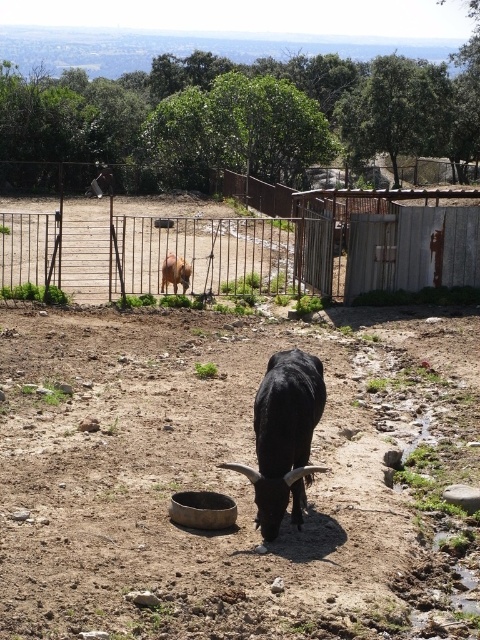
Question: Can you confirm if brown soil at center is wider than light brown fur at center?

Choices:
 (A) yes
 (B) no

Answer: (A)

Question: Observing the image, what is the correct spatial positioning of rusty metal fence at upper center in reference to light brown fur at center?

Choices:
 (A) below
 (B) above

Answer: (B)

Question: Is black matte/yak at center to the right of light brown fur at center from the viewer's perspective?

Choices:
 (A) no
 (B) yes

Answer: (B)

Question: Among these objects, which one is farthest from the camera?

Choices:
 (A) rusty metal fence at upper center
 (B) brown soil at center
 (C) light brown fur at center
 (D) black matte/yak at center

Answer: (C)

Question: Which point is farther from the camera taking this photo?

Choices:
 (A) (257, 225)
 (B) (1, 544)

Answer: (A)

Question: Estimate the real-world distances between objects in this image. Which object is closer to the rusty metal fence at upper center?

Choices:
 (A) brown soil at center
 (B) black matte/yak at center

Answer: (A)